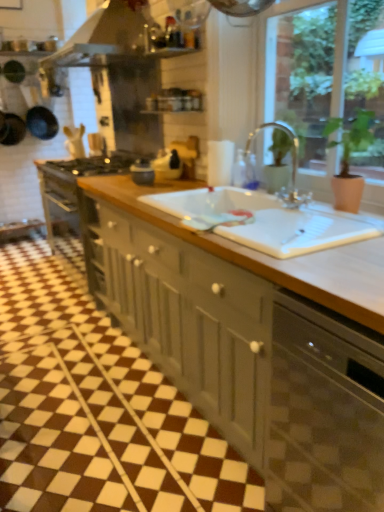
Question: Considering the relative sizes of satin black dishwasher at lower right and metallic silver exhaust hood at upper center in the image provided, is satin black dishwasher at lower right wider than metallic silver exhaust hood at upper center?

Choices:
 (A) yes
 (B) no

Answer: (A)

Question: Could you tell me if satin black dishwasher at lower right is facing metallic silver exhaust hood at upper center?

Choices:
 (A) no
 (B) yes

Answer: (A)

Question: Is satin black dishwasher at lower right positioned behind metallic silver exhaust hood at upper center?

Choices:
 (A) yes
 (B) no

Answer: (B)

Question: Is satin black dishwasher at lower right turned away from metallic silver exhaust hood at upper center?

Choices:
 (A) yes
 (B) no

Answer: (B)

Question: Considering the relative sizes of satin black dishwasher at lower right and metallic silver exhaust hood at upper center in the image provided, is satin black dishwasher at lower right shorter than metallic silver exhaust hood at upper center?

Choices:
 (A) yes
 (B) no

Answer: (B)

Question: From the image's perspective, is satin black dishwasher at lower right on top of metallic silver exhaust hood at upper center?

Choices:
 (A) yes
 (B) no

Answer: (B)

Question: Is clear glass faucet at upper center positioned in front of satin black dishwasher at lower right?

Choices:
 (A) no
 (B) yes

Answer: (A)

Question: Does clear glass faucet at upper center have a greater width compared to satin black dishwasher at lower right?

Choices:
 (A) no
 (B) yes

Answer: (A)

Question: Does clear glass faucet at upper center have a greater height compared to satin black dishwasher at lower right?

Choices:
 (A) yes
 (B) no

Answer: (B)

Question: Is clear glass faucet at upper center to the left of satin black dishwasher at lower right from the viewer's perspective?

Choices:
 (A) yes
 (B) no

Answer: (A)

Question: Is clear glass faucet at upper center in contact with satin black dishwasher at lower right?

Choices:
 (A) yes
 (B) no

Answer: (B)

Question: Is satin black dishwasher at lower right surrounded by clear glass faucet at upper center?

Choices:
 (A) yes
 (B) no

Answer: (B)

Question: Is matte gray cabinets at center next to green matte plant at upper right?

Choices:
 (A) yes
 (B) no

Answer: (B)